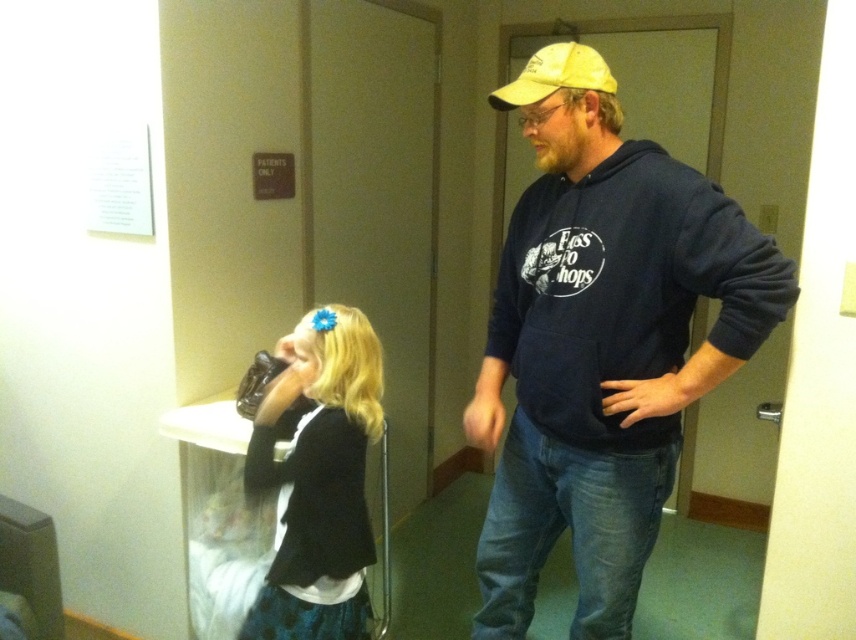
Question: Which of these objects is positioned closest to the yellow fabric baseball cap at upper right?

Choices:
 (A) dark blue hoodie at center
 (B) matte black jacket at center

Answer: (A)

Question: Can you confirm if matte black jacket at center is smaller than yellow fabric baseball cap at upper right?

Choices:
 (A) yes
 (B) no

Answer: (B)

Question: Among these points, which one is farthest from the camera?

Choices:
 (A) (324, 529)
 (B) (527, 72)

Answer: (A)

Question: Is dark blue hoodie at center to the left of yellow fabric baseball cap at upper right from the viewer's perspective?

Choices:
 (A) yes
 (B) no

Answer: (B)

Question: Does matte black jacket at center appear on the right side of yellow fabric baseball cap at upper right?

Choices:
 (A) no
 (B) yes

Answer: (A)

Question: Estimate the real-world distances between objects in this image. Which object is closer to the matte black jacket at center?

Choices:
 (A) yellow fabric baseball cap at upper right
 (B) dark blue hoodie at center

Answer: (B)